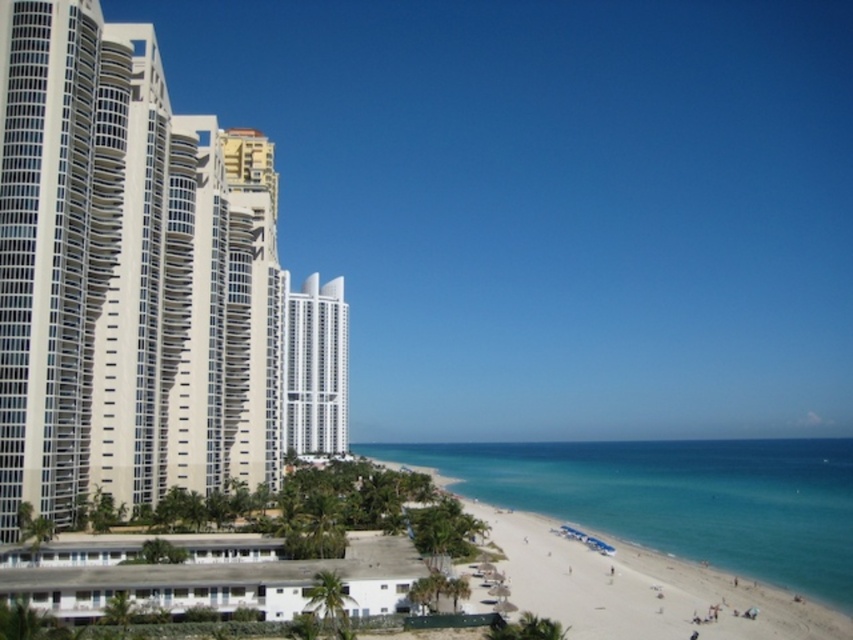
Question: Can you confirm if clear blue water at beach right is bigger than white glossy building at center?

Choices:
 (A) yes
 (B) no

Answer: (A)

Question: Estimate the real-world distances between objects in this image. Which object is closer to the white glass building at left?

Choices:
 (A) white glossy building at center
 (B) clear blue water at beach right

Answer: (A)

Question: Which of the following is the closest to the observer?

Choices:
 (A) clear blue water at beach right
 (B) white glossy building at center
 (C) white glass building at left

Answer: (C)

Question: Considering the relative positions of clear blue water at beach right and white glossy building at center in the image provided, where is clear blue water at beach right located with respect to white glossy building at center?

Choices:
 (A) above
 (B) below

Answer: (B)

Question: Where is white glass building at left located in relation to clear blue water at beach right in the image?

Choices:
 (A) above
 (B) below

Answer: (A)

Question: Which point is farther to the camera?

Choices:
 (A) (625, 497)
 (B) (305, 413)
 (C) (265, 205)

Answer: (B)